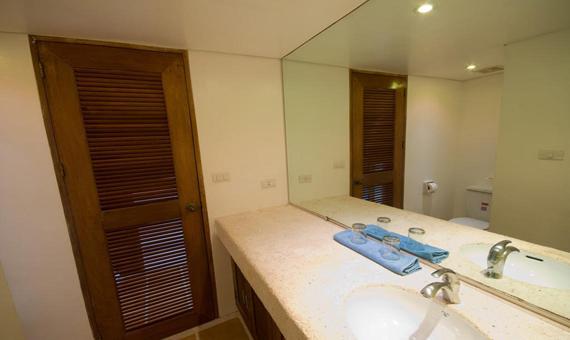
Locate an element on the screen. bathroom is located at coordinates (223, 92).